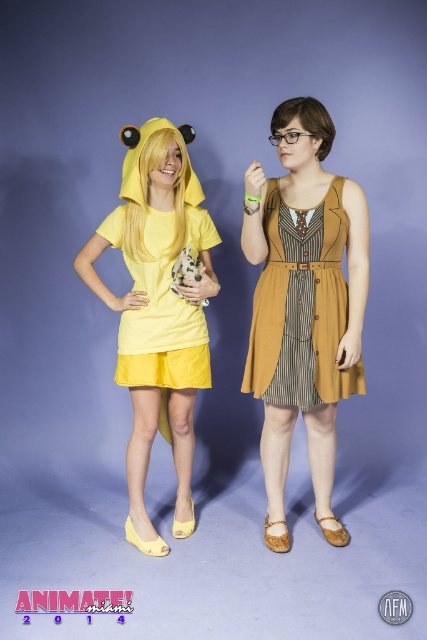
Does mustard fabric dress at center have a greater height compared to matte yellow dress at center?

Correct, mustard fabric dress at center is much taller as matte yellow dress at center.

Between point (322, 316) and point (105, 236), which one is positioned behind?

Positioned behind is point (105, 236).

Is point (283, 410) positioned behind point (160, 193)?

Yes, it is.

At what (x,y) coordinates should I click in order to perform the action: click on mustard fabric dress at center. Please return your answer as a coordinate pair (x, y). This screenshot has width=427, height=640. Looking at the image, I should click on (304, 305).

Does matte yellow dress at center appear under mustard linen dress at center?

Yes, matte yellow dress at center is below mustard linen dress at center.

Does matte yellow dress at center have a greater height compared to mustard linen dress at center?

Indeed, matte yellow dress at center has a greater height compared to mustard linen dress at center.

The height and width of the screenshot is (640, 427). Describe the element at coordinates (157, 314) in the screenshot. I see `matte yellow dress at center` at that location.

This screenshot has width=427, height=640. Find the location of `matte yellow dress at center`. matte yellow dress at center is located at coordinates (157, 314).

Can you confirm if mustard fabric dress at center is smaller than mustard linen dress at center?

Incorrect, mustard fabric dress at center is not smaller in size than mustard linen dress at center.

Can you confirm if mustard fabric dress at center is thinner than mustard linen dress at center?

Yes, mustard fabric dress at center is thinner than mustard linen dress at center.

Locate an element on the screen. Image resolution: width=427 pixels, height=640 pixels. mustard fabric dress at center is located at coordinates (304, 305).

The image size is (427, 640). Find the location of `mustard fabric dress at center`. mustard fabric dress at center is located at coordinates (304, 305).